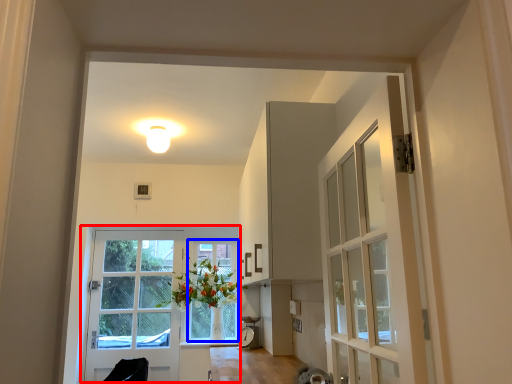
Question: Which point is further to the camera, door (highlighted by a red box) or window frame (highlighted by a blue box)?

Choices:
 (A) door
 (B) window frame

Answer: (B)